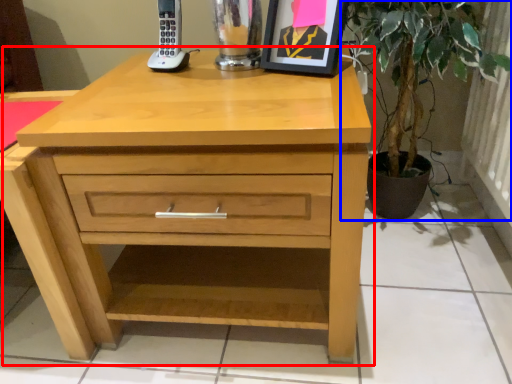
Question: Which object is further to the camera taking this photo, chest of drawers (highlighted by a red box) or houseplant (highlighted by a blue box)?

Choices:
 (A) chest of drawers
 (B) houseplant

Answer: (B)